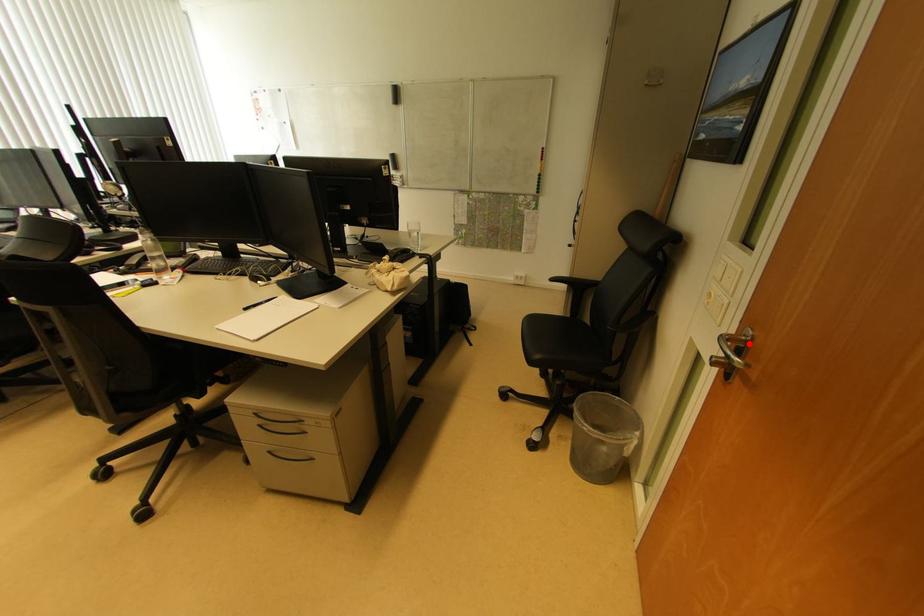
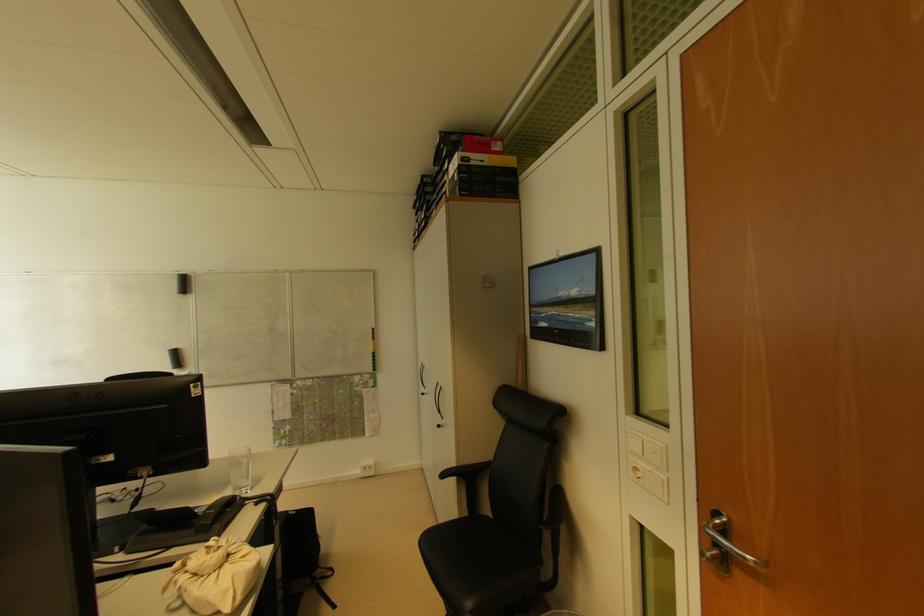
Locate, in the second image, the point that corresponds to the highlighted location in the first image.

(726, 527)